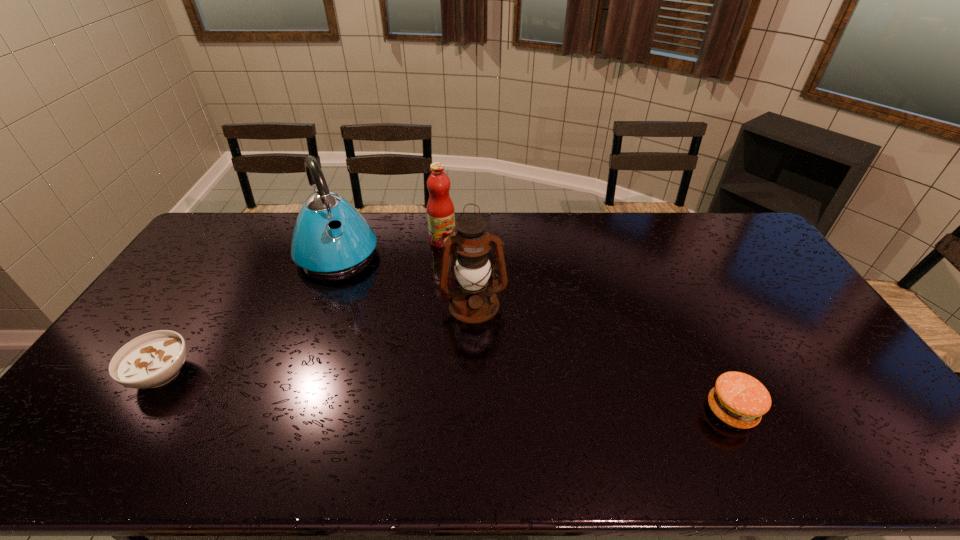
Find the location of a particular element. The height and width of the screenshot is (540, 960). vacant space that is in between the leftmost object and the patty is located at coordinates (446, 392).

Identify the location of vacant point located between the kettle and the soup bowl. The height and width of the screenshot is (540, 960). (250, 314).

This screenshot has height=540, width=960. Identify the location of vacant space that is in between the second shortest object and the leftmost object. (446, 392).

Locate an element on the screen. This screenshot has height=540, width=960. vacant area that lies between the third shortest object and the rightmost object is located at coordinates (588, 326).

Identify the location of free space between the third tallest object and the soup bowl. This screenshot has height=540, width=960. (302, 307).

You are a GUI agent. You are given a task and a screenshot of the screen. Output one action in this format:
    pyautogui.click(x=<x>, y=<y>)
    Task: Click on the vacant space that is in between the soup bowl and the rightmost object
    
    Given the screenshot: What is the action you would take?
    pyautogui.click(x=446, y=392)

Locate an element on the screen. The width and height of the screenshot is (960, 540). free space between the shortest object and the fruit juice is located at coordinates (302, 307).

Where is `vacant space that's between the second shortest object and the lantern`? This screenshot has width=960, height=540. vacant space that's between the second shortest object and the lantern is located at coordinates (603, 357).

The image size is (960, 540). What are the coordinates of `free spot between the third tallest object and the rightmost object` in the screenshot? It's located at (588, 326).

The image size is (960, 540). What are the coordinates of `object that is the second closest to the third farthest object` in the screenshot? It's located at [x=348, y=244].